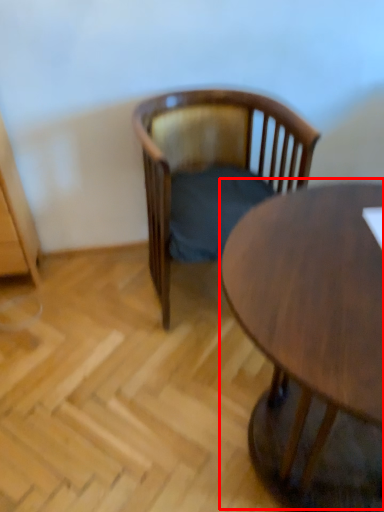
Question: From the image's perspective, what is the correct spatial relationship of coffee table (annotated by the red box) in relation to chair?

Choices:
 (A) above
 (B) below

Answer: (B)